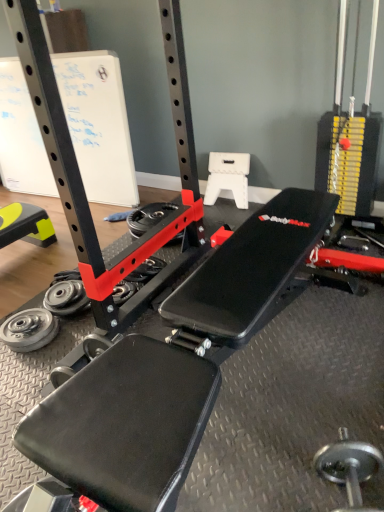
Find the location of a particular element. This screenshot has height=512, width=384. free space in front of silver metallic weight plate at lower left, marked as the 1th wheel in a left-to-right arrangement is located at coordinates (25, 366).